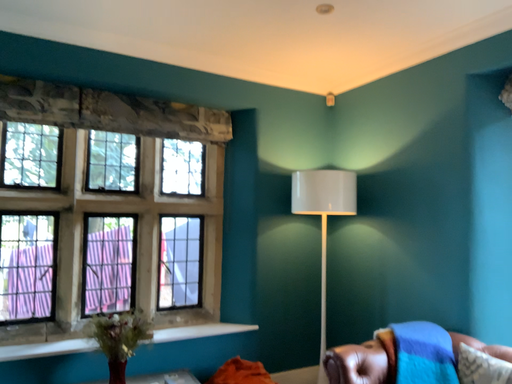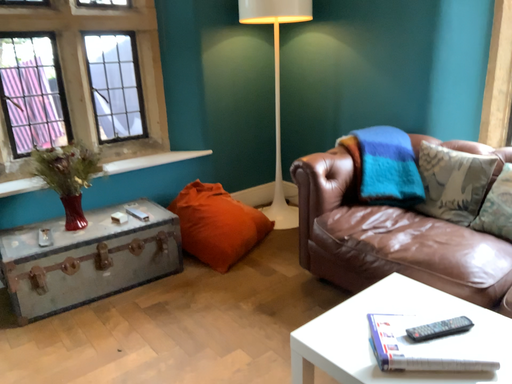
Question: Which way did the camera rotate in the video?

Choices:
 (A) rotated upward
 (B) rotated downward

Answer: (B)